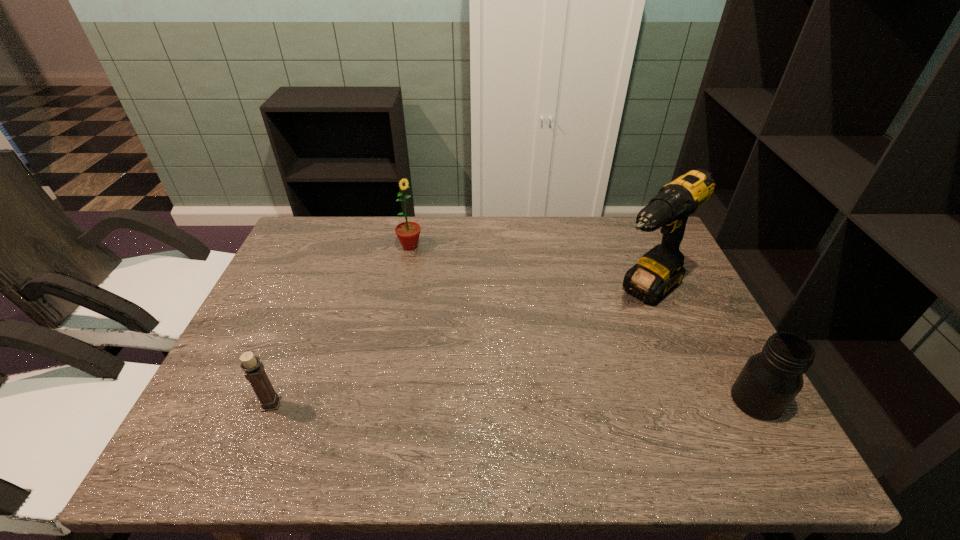
At what (x,y) coordinates should I click in order to perform the action: click on object located in the near left corner section of the desktop. Please return your answer as a coordinate pair (x, y). The height and width of the screenshot is (540, 960). Looking at the image, I should click on (254, 370).

What are the coordinates of `object located at the near right corner` in the screenshot? It's located at (770, 380).

This screenshot has width=960, height=540. Find the location of `vacant space at the far edge of the desktop`. vacant space at the far edge of the desktop is located at coordinates (580, 244).

Find the location of a particular element. The height and width of the screenshot is (540, 960). blank area at the near edge is located at coordinates (616, 414).

In the image, there is a desktop. Identify the location of vacant space at the left edge. (275, 377).

Image resolution: width=960 pixels, height=540 pixels. In order to click on blank space at the far left corner of the desktop in this screenshot , I will do `click(299, 252)`.

Where is `vacant space at the near left corner of the desktop`? The height and width of the screenshot is (540, 960). vacant space at the near left corner of the desktop is located at coordinates (206, 399).

In order to click on vacant space at the far right corner in this screenshot , I will do (637, 254).

The width and height of the screenshot is (960, 540). What are the coordinates of `empty space that is in between the farthest object and the leftmost object` in the screenshot? It's located at (341, 325).

Identify the location of vacant area between the jar and the candle holder. This screenshot has height=540, width=960. point(514,402).